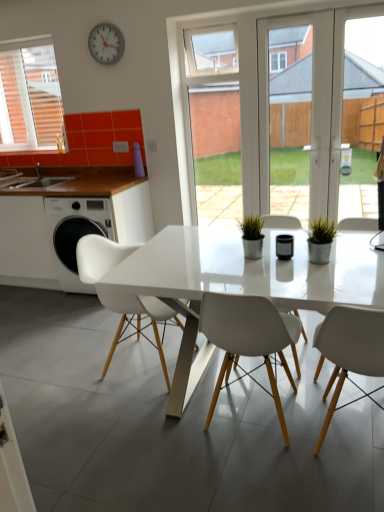
Question: From a real-world perspective, is black glossy pen holder at center under white matte chair at center, the second chair when ordered from left to right?

Choices:
 (A) no
 (B) yes

Answer: (A)

Question: Is black glossy pen holder at center turned away from white matte chair at center, acting as the 2th chair starting from the right?

Choices:
 (A) no
 (B) yes

Answer: (A)

Question: From a real-world perspective, is black glossy pen holder at center physically above white matte chair at center, the second chair when ordered from left to right?

Choices:
 (A) yes
 (B) no

Answer: (A)

Question: Can you confirm if black glossy pen holder at center is positioned to the right of white matte chair at center, the second chair when ordered from left to right?

Choices:
 (A) no
 (B) yes

Answer: (B)

Question: Could white matte chair at center, acting as the 2th chair starting from the right, be considered to be inside black glossy pen holder at center?

Choices:
 (A) yes
 (B) no

Answer: (B)

Question: From the image's perspective, is black glossy pen holder at center under white matte chair at center, the second chair when ordered from left to right?

Choices:
 (A) yes
 (B) no

Answer: (B)

Question: Is white glossy sink at left oriented towards metallic gray clock at upper center?

Choices:
 (A) yes
 (B) no

Answer: (B)

Question: Does white glossy sink at left have a greater width compared to metallic gray clock at upper center?

Choices:
 (A) yes
 (B) no

Answer: (A)

Question: From the image's perspective, does white glossy sink at left appear higher than metallic gray clock at upper center?

Choices:
 (A) yes
 (B) no

Answer: (B)

Question: From the image's perspective, is white glossy sink at left located beneath metallic gray clock at upper center?

Choices:
 (A) no
 (B) yes

Answer: (B)

Question: Does white glossy sink at left come behind metallic gray clock at upper center?

Choices:
 (A) no
 (B) yes

Answer: (B)

Question: From a real-world perspective, does white glossy sink at left sit lower than metallic gray clock at upper center?

Choices:
 (A) no
 (B) yes

Answer: (B)

Question: From a real-world perspective, is white plastic chair at left on black glossy pen holder at center?

Choices:
 (A) yes
 (B) no

Answer: (B)